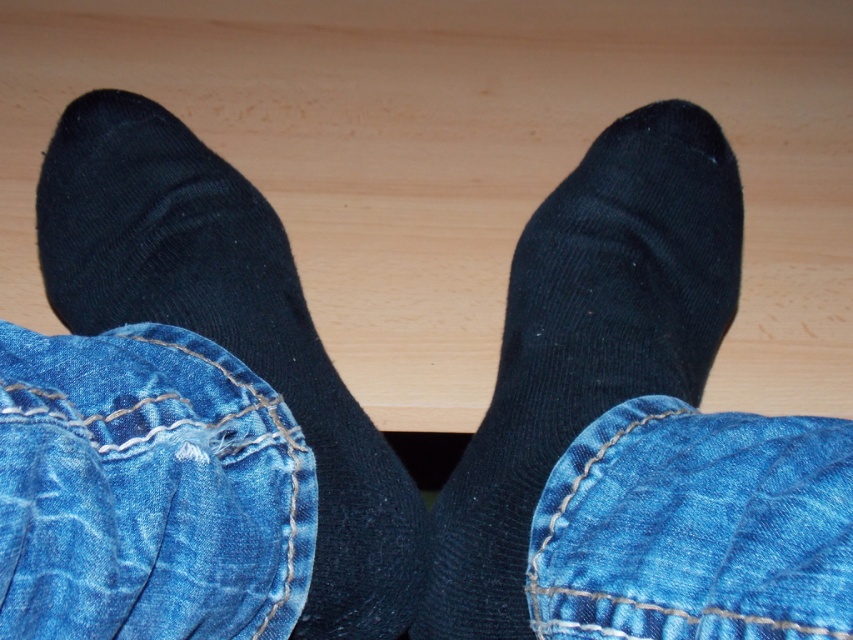
Question: Which point is closer to the camera?

Choices:
 (A) denim/jeans at lower right
 (B) black ribbed sock at center

Answer: (A)

Question: Is denim/jeans at lower left positioned at the back of black cotton sock at center?

Choices:
 (A) yes
 (B) no

Answer: (B)

Question: Which object is closer to the camera taking this photo?

Choices:
 (A) denim/jeans at lower right
 (B) black cotton sock at center

Answer: (A)

Question: Can you confirm if denim/jeans at lower left is positioned to the left of black cotton sock at center?

Choices:
 (A) no
 (B) yes

Answer: (A)

Question: Does denim/jeans at lower left appear on the right side of black ribbed sock at center?

Choices:
 (A) yes
 (B) no

Answer: (B)

Question: Which point appears farthest from the camera in this image?

Choices:
 (A) (663, 122)
 (B) (225, 292)

Answer: (A)